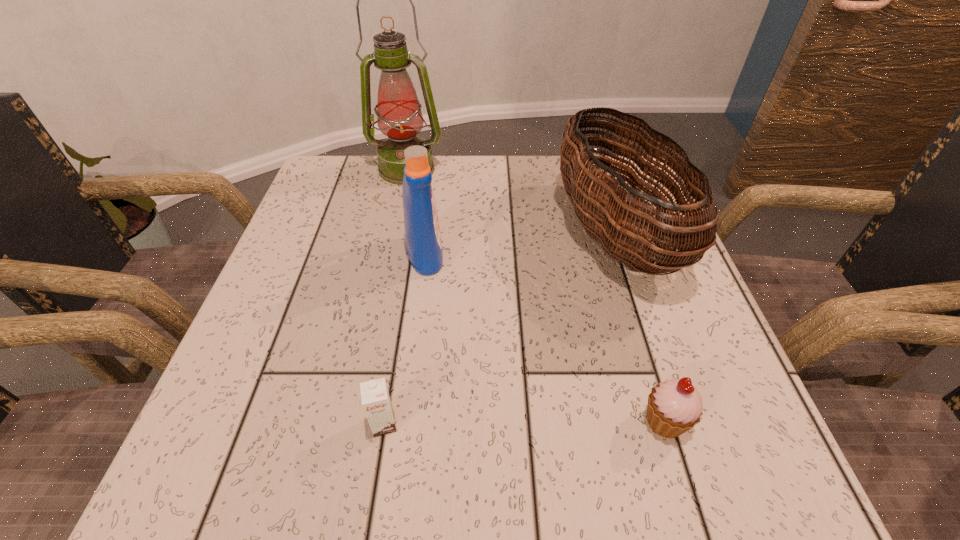
At what (x,y) coordinates should I click in order to perform the action: click on vacant space that's between the second tallest object and the basket. Please return your answer as a coordinate pair (x, y). The height and width of the screenshot is (540, 960). Looking at the image, I should click on (519, 243).

You are a GUI agent. You are given a task and a screenshot of the screen. Output one action in this format:
    pyautogui.click(x=<x>, y=<y>)
    Task: Click on the vacant point located between the basket and the cupcake
    This screenshot has height=540, width=960.
    Given the screenshot: What is the action you would take?
    pyautogui.click(x=639, y=327)

In order to click on free space between the third shortest object and the chocolate milk in this screenshot , I will do `click(499, 328)`.

Identify the location of object that is the third closest to the cupcake. This screenshot has height=540, width=960. (422, 232).

Point out which object is positioned as the second nearest to the chocolate milk. Please provide its 2D coordinates. Your answer should be formatted as a tuple, i.e. [(x, y)], where the tuple contains the x and y coordinates of a point satisfying the conditions above.

[(616, 234)]

What are the coordinates of `vacant position in the image that satisfies the following two spatial constraints: 1. on the back side of the cupcake; 2. on the label of the fourth shortest object` in the screenshot? It's located at (613, 253).

Where is `vacant area in the image that satisfies the following two spatial constraints: 1. on the front side of the tallest object; 2. on the right side of the chocolate milk`? vacant area in the image that satisfies the following two spatial constraints: 1. on the front side of the tallest object; 2. on the right side of the chocolate milk is located at coordinates (353, 424).

Where is `free region that satisfies the following two spatial constraints: 1. on the front side of the oil lamp; 2. on the right side of the cupcake`? free region that satisfies the following two spatial constraints: 1. on the front side of the oil lamp; 2. on the right side of the cupcake is located at coordinates (354, 421).

The width and height of the screenshot is (960, 540). Identify the location of vacant space that satisfies the following two spatial constraints: 1. on the label of the cupcake; 2. on the left side of the second tallest object. (404, 421).

Where is `free space in the image that satisfies the following two spatial constraints: 1. on the front side of the tallest object; 2. on the right side of the chocolate milk`? This screenshot has width=960, height=540. free space in the image that satisfies the following two spatial constraints: 1. on the front side of the tallest object; 2. on the right side of the chocolate milk is located at coordinates (353, 424).